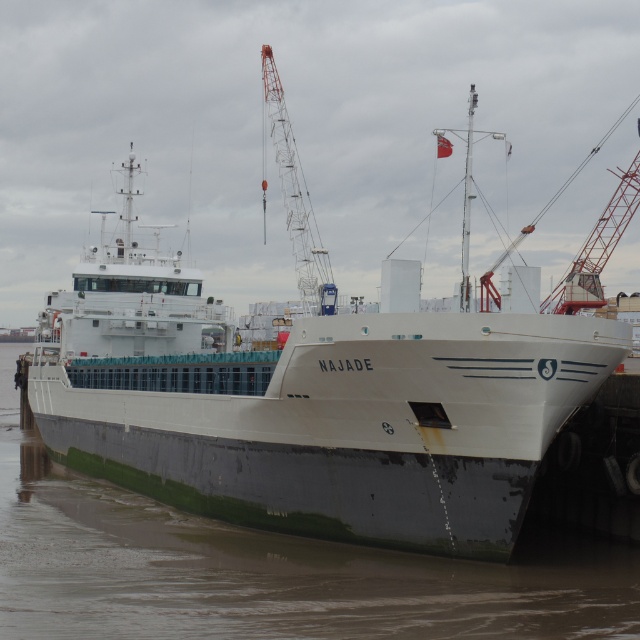
Can you confirm if green matte water at lower left is thinner than red painted metal crane at center?

No, green matte water at lower left is not thinner than red painted metal crane at center.

Does point (124, 628) come in front of point (292, 202)?

That is True.

I want to click on green matte water at lower left, so click(x=266, y=570).

Consider the image. Who is more distant from viewer, (440, 532) or (0, 368)?

Positioned behind is point (0, 368).

Who is higher up, white matte ship at center or green matte water at lower left?

Positioned higher is white matte ship at center.

Where is `white matte ship at center`? This screenshot has height=640, width=640. white matte ship at center is located at coordinates [x=310, y=406].

Who is more forward, (33, 365) or (301, 243)?

Positioned in front is point (33, 365).

At what (x,y) coordinates should I click in order to perform the action: click on white matte ship at center. Please return your answer as a coordinate pair (x, y). Looking at the image, I should click on (310, 406).